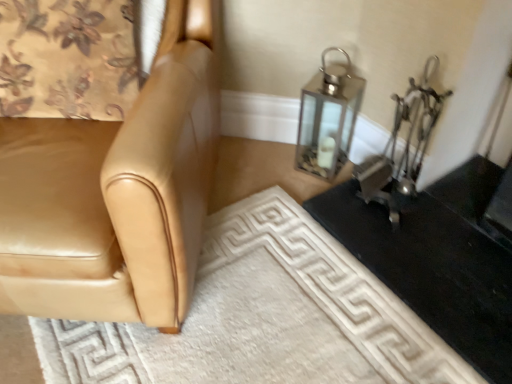
Find the location of a particular element. vacant location below white textured doormat at lower center (from a real-world perspective) is located at coordinates (295, 303).